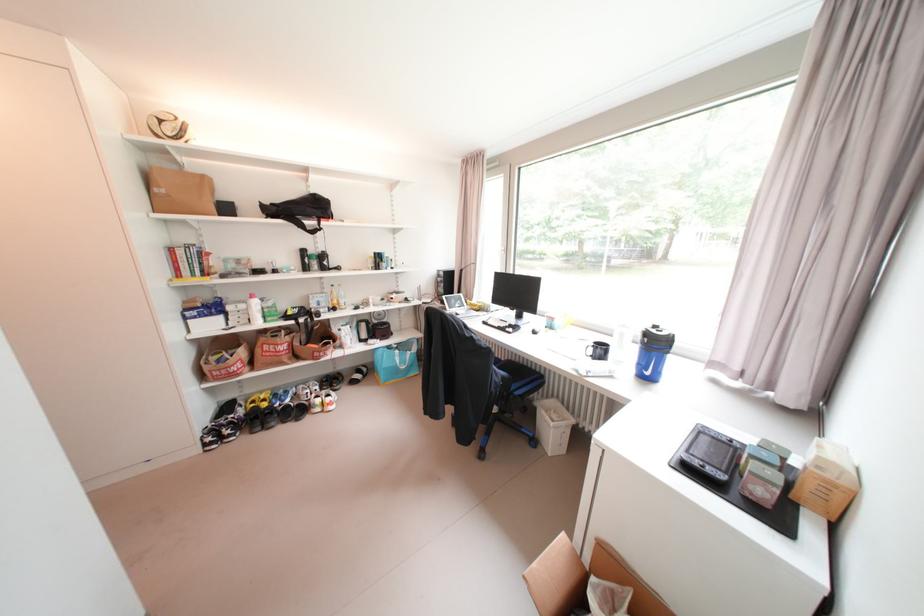
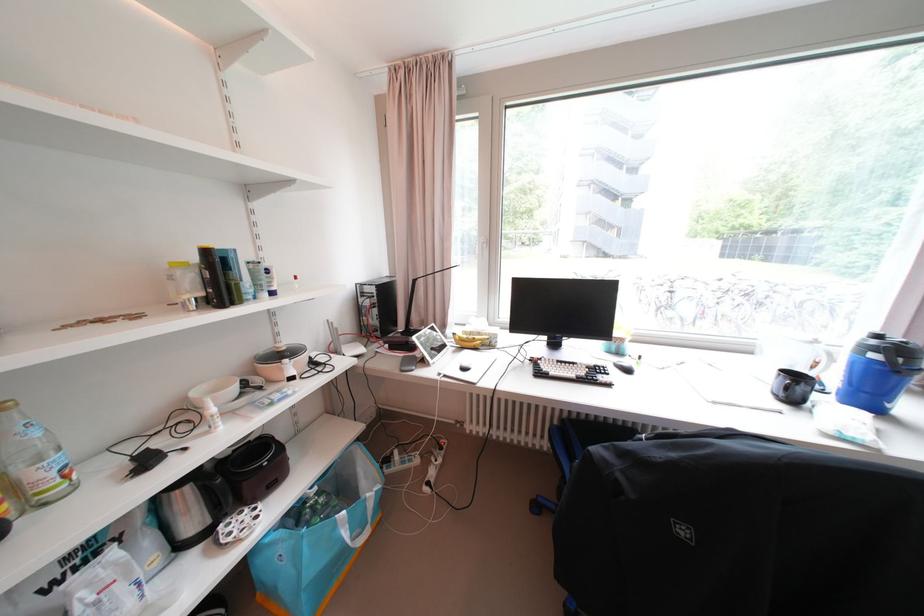
Where in the second image is the point corresponding to pixel 347 286 from the first image?

(6, 410)